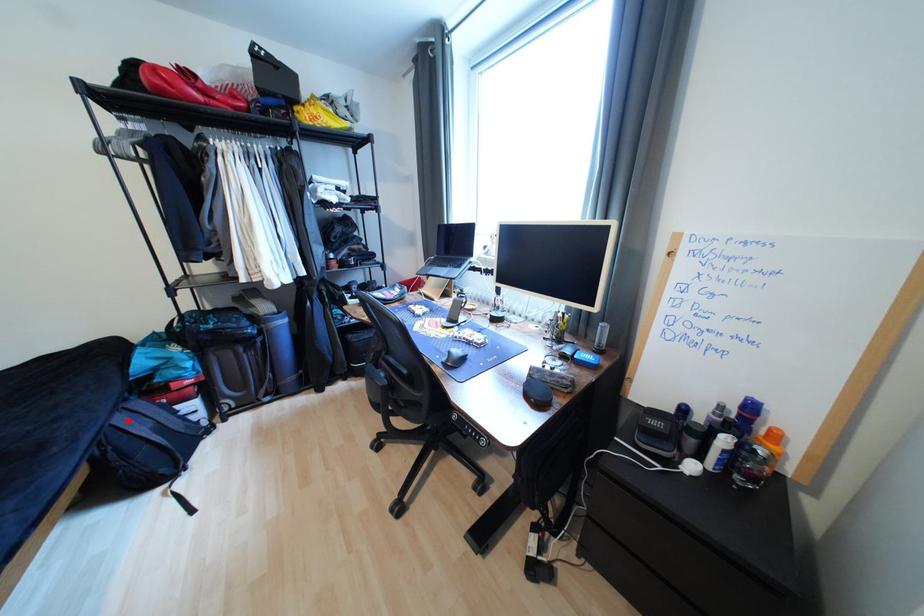
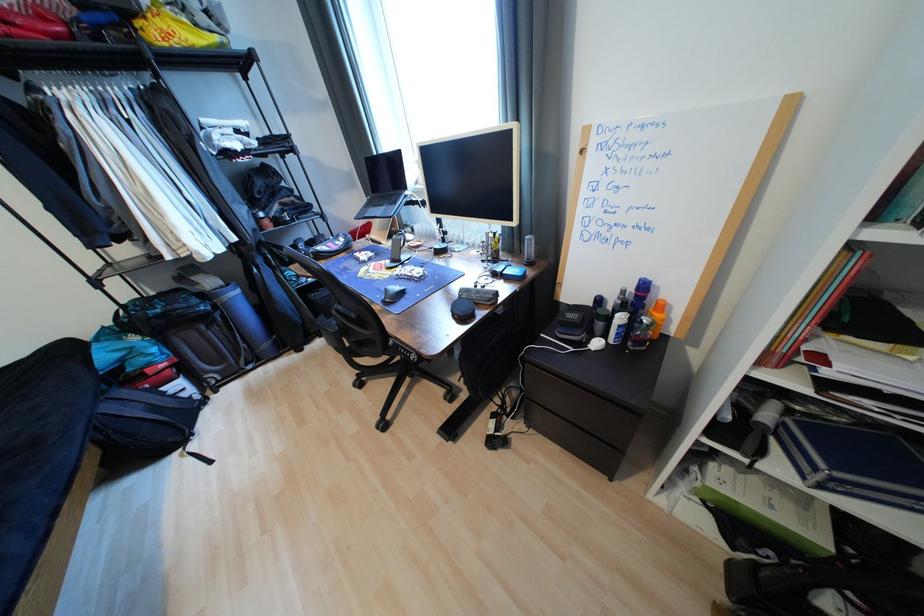
The point at the highlighted location is marked in the first image. Where is the corresponding point in the second image?

(116, 408)